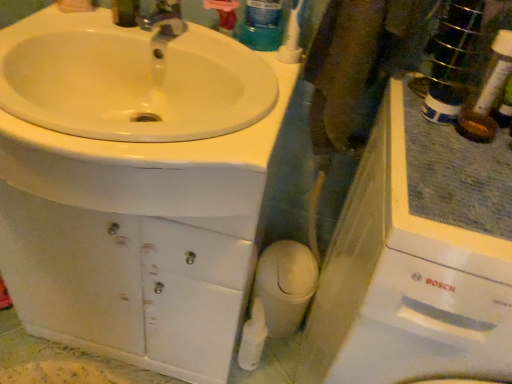
Question: Do you think white plastic toothbrush at upper right is within translucent plastic mouthwash at upper center, or outside of it?

Choices:
 (A) inside
 (B) outside

Answer: (B)

Question: Does point (291, 36) appear closer or farther from the camera than point (264, 16)?

Choices:
 (A) closer
 (B) farther

Answer: (B)

Question: Which of these objects is positioned farthest from the white plastic toothbrush at upper right?

Choices:
 (A) translucent plastic mouthwash at upper center
 (B) white glossy sink at upper left

Answer: (B)

Question: Which object is positioned farthest from the translucent plastic mouthwash at upper center?

Choices:
 (A) white glossy sink at upper left
 (B) white plastic toothbrush at upper right

Answer: (A)